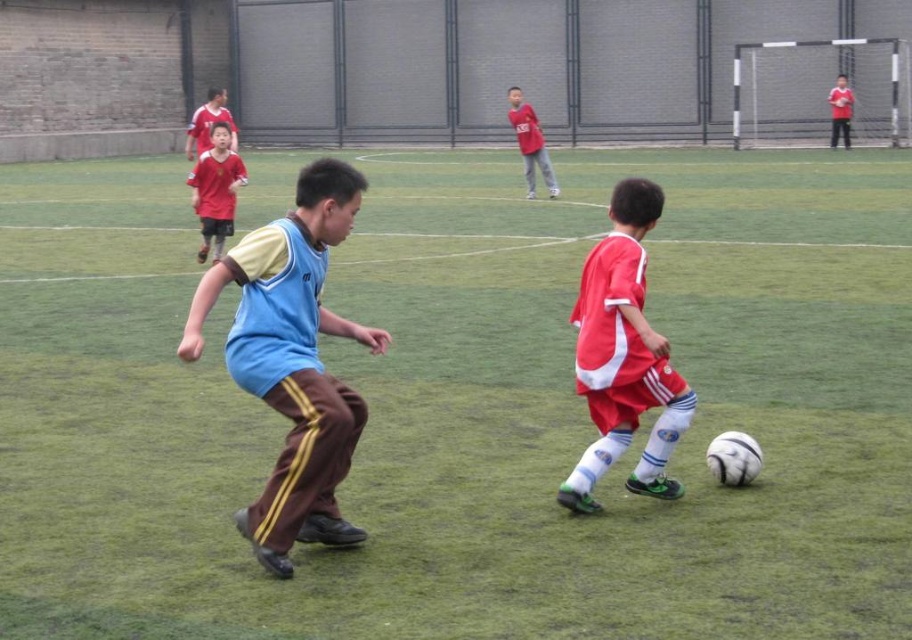
You are a soccer referee standing at the center of the field. You need to determine which of the two points, point [587,400] or point [517,132], is closer to you. Which one is closer?

Point [587,400] is closer to the camera than point [517,132], so the referee would determine that point [587,400] is closer to them.

You are a coach observing the soccer match. You notice the red matte soccer player at center and the matte red jersey at center. Which one appears to be larger in size?

The matte red jersey at center is larger in size compared to the red matte soccer player at center.

You are a soccer coach observing the match. You notice the blue jersey at center and the matte blue shirt at upper center. Which player is more likely to be a defender based on their clothing? Explain your reasoning.

The blue jersey at center is thinner than the matte blue shirt at upper center. Since defenders often wear lighter or more streamlined clothing for agility, the blue jersey at center is more likely to be a defender.